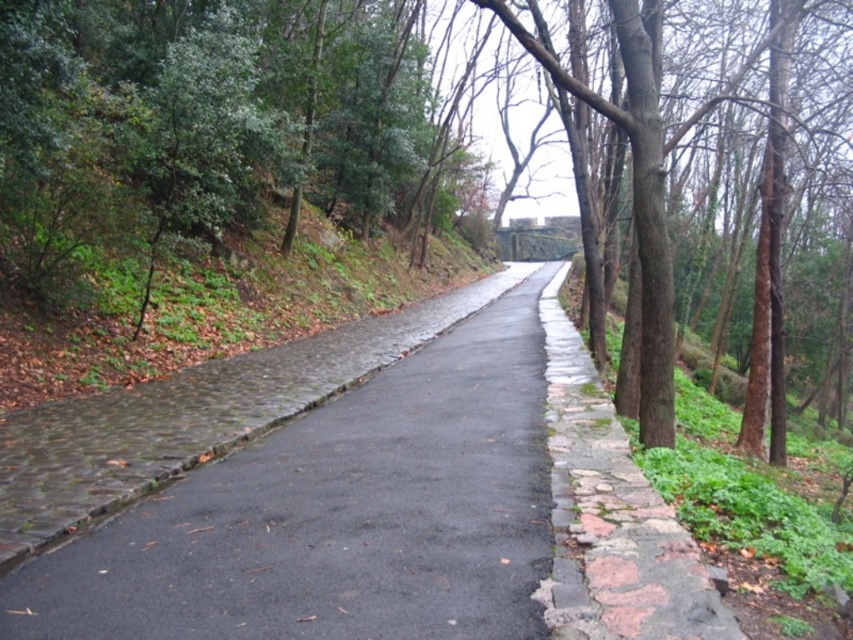
Is brown rough tree at center further to camera compared to black asphalt road at center?

Yes, brown rough tree at center is further from the viewer.

Can you confirm if brown rough tree at center is bigger than black asphalt road at center?

Yes, brown rough tree at center is bigger than black asphalt road at center.

Is point (646, 108) closer to viewer compared to point (427, 564)?

No, it is behind (427, 564).

The width and height of the screenshot is (853, 640). I want to click on brown rough tree at center, so click(402, 164).